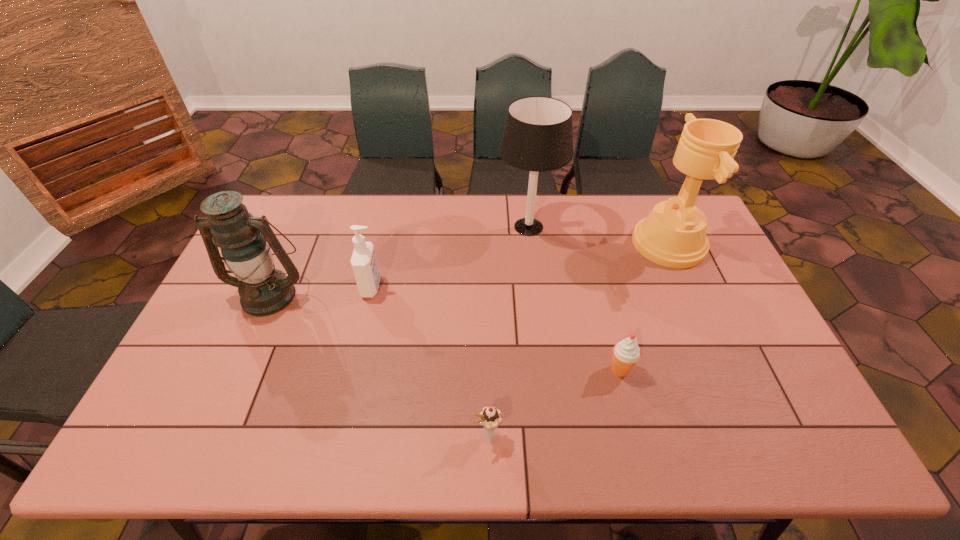
The width and height of the screenshot is (960, 540). Find the location of `unoccupied area between the fourth object from left to right and the oil lamp`. unoccupied area between the fourth object from left to right and the oil lamp is located at coordinates (399, 261).

At what (x,y) coordinates should I click in order to perform the action: click on free space that is in between the cleansing agent and the oil lamp. Please return your answer as a coordinate pair (x, y). Looking at the image, I should click on (321, 291).

Locate an element on the screen. This screenshot has width=960, height=540. free space that is in between the cleansing agent and the fifth farthest object is located at coordinates (495, 328).

Locate an element on the screen. The height and width of the screenshot is (540, 960). vacant area that lies between the table lamp and the third object from left to right is located at coordinates (508, 330).

Where is `free area in between the farther icecream and the left icecream`? This screenshot has height=540, width=960. free area in between the farther icecream and the left icecream is located at coordinates (554, 402).

Find the location of a particular element. The width and height of the screenshot is (960, 540). vacant region between the third object from right to left and the oil lamp is located at coordinates (399, 261).

At what (x,y) coordinates should I click in order to perform the action: click on object that can be found as the fourth closest to the third object from right to left. Please return your answer as a coordinate pair (x, y). Looking at the image, I should click on (263, 291).

Select which object appears as the third closest to the table lamp. Please provide its 2D coordinates. Your answer should be formatted as a tuple, i.e. [(x, y)], where the tuple contains the x and y coordinates of a point satisfying the conditions above.

[(626, 353)]

The image size is (960, 540). I want to click on vacant space that satisfies the following two spatial constraints: 1. on the front label of the second object from left to right; 2. on the left side of the right icecream, so click(352, 370).

Identify the location of free space that satisfies the following two spatial constraints: 1. on the front label of the fifth object from right to left; 2. on the left side of the nearer icecream. (337, 435).